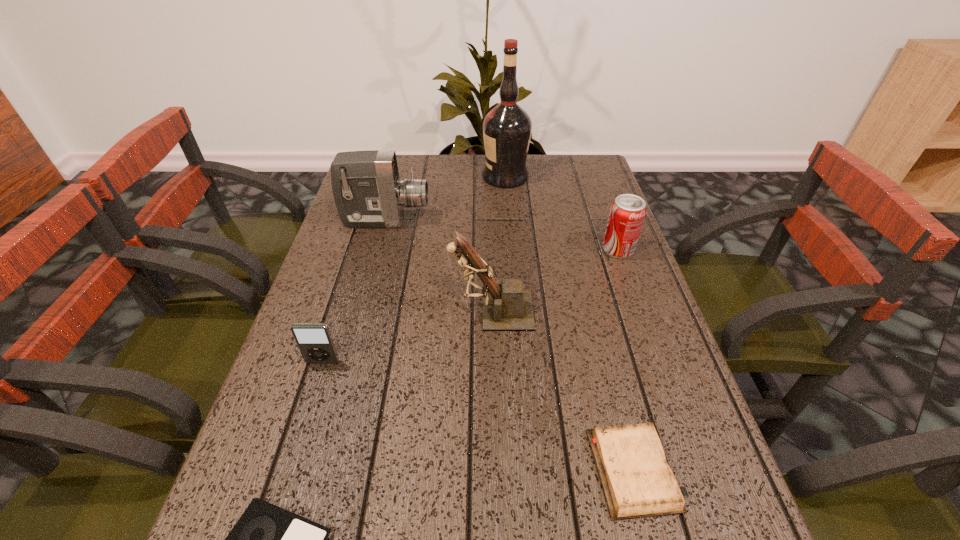
Identify the location of free location located 0.330m on the surface of the farthest object. (379, 177).

The height and width of the screenshot is (540, 960). Identify the location of free space located on the surface of the farthest object. (464, 177).

Identify the location of vacant space located 0.240m on the front-facing side of the figurine. (343, 311).

Locate an element on the screen. The image size is (960, 540). vacant area situated on the front-facing side of the figurine is located at coordinates (307, 311).

At what (x,y) coordinates should I click in order to perform the action: click on vacant space located on the front-facing side of the figurine. Please return your answer as a coordinate pair (x, y). This screenshot has height=540, width=960. Looking at the image, I should click on (302, 311).

Find the location of a particular element. vacant space situated at the front of the camcorder, highlighting the lens is located at coordinates [x=457, y=221].

The height and width of the screenshot is (540, 960). Identify the location of vacant space located 0.220m on the front of the fourth shortest object. (645, 327).

I want to click on vacant space located on the front-facing side of the third nearest object, so click(x=304, y=420).

You are a GUI agent. You are given a task and a screenshot of the screen. Output one action in this format:
    pyautogui.click(x=<x>, y=<y>)
    Task: Click on the free spot located on the back of the sixth tallest object
    This screenshot has height=540, width=960.
    Given the screenshot: What is the action you would take?
    pyautogui.click(x=617, y=401)

Identify the location of object present at the far edge. (507, 128).